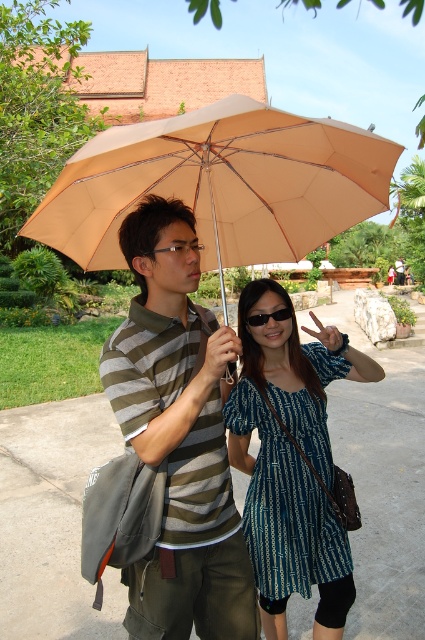
Who is shorter, beige fabric umbrella at upper center or black plastic goggles at center?

With less height is black plastic goggles at center.

Does beige fabric umbrella at upper center appear over black plastic goggles at center?

Yes, beige fabric umbrella at upper center is above black plastic goggles at center.

The image size is (425, 640). Identify the location of beige fabric umbrella at upper center. (221, 182).

Can you confirm if blue printed dress at center is shorter than black plastic goggles at center?

No.

Image resolution: width=425 pixels, height=640 pixels. I want to click on blue printed dress at center, so click(291, 460).

The image size is (425, 640). What are the coordinates of `blue printed dress at center` in the screenshot? It's located at tap(291, 460).

Does striped cotton shirt at center come in front of black plastic goggles at center?

Yes, striped cotton shirt at center is in front of black plastic goggles at center.

Find the location of `striped cotton shirt at center`. striped cotton shirt at center is located at coordinates (178, 435).

Identify the location of striped cotton shirt at center. The width and height of the screenshot is (425, 640). (178, 435).